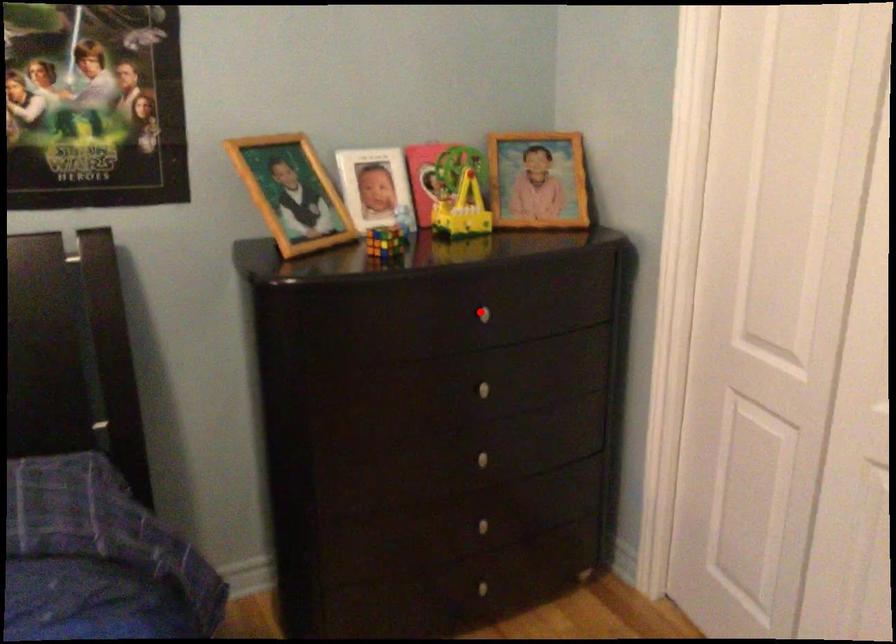
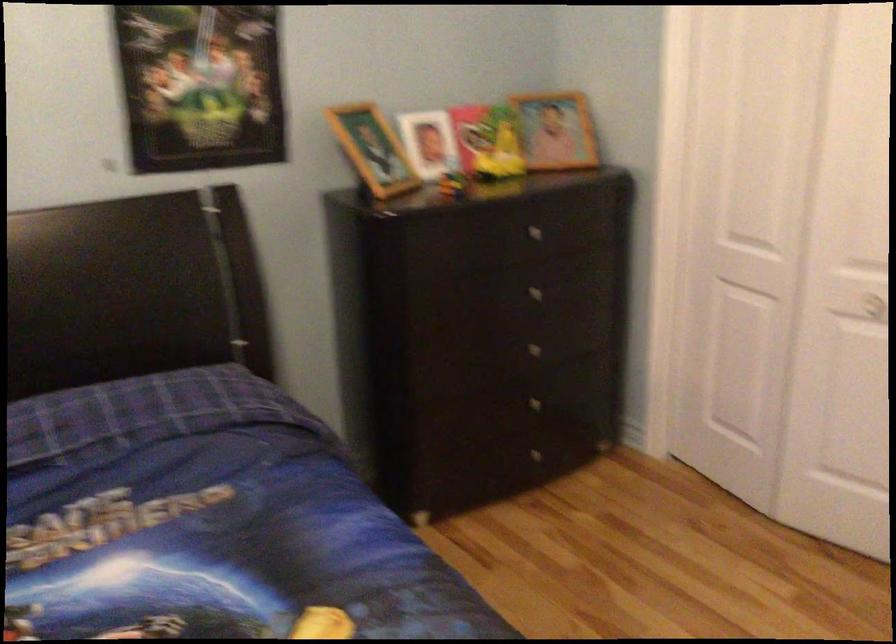
The point at the highlighted location is marked in the first image. Where is the corresponding point in the second image?

(530, 230)